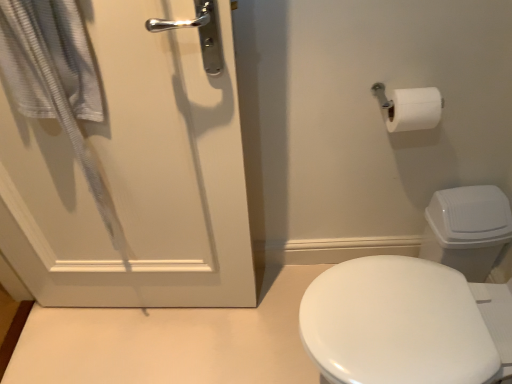
The image size is (512, 384). I want to click on space that is in front of white matte door at left, so click(x=143, y=349).